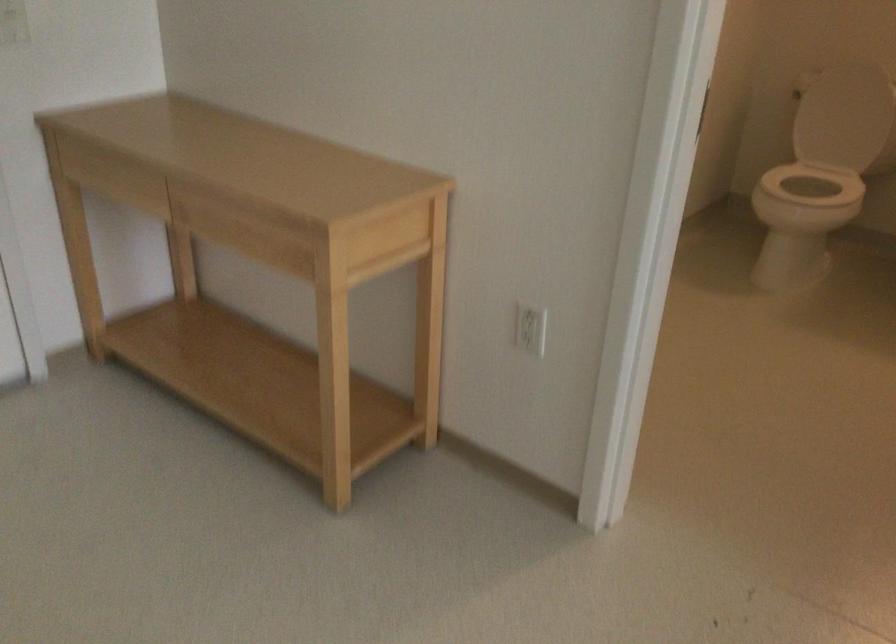
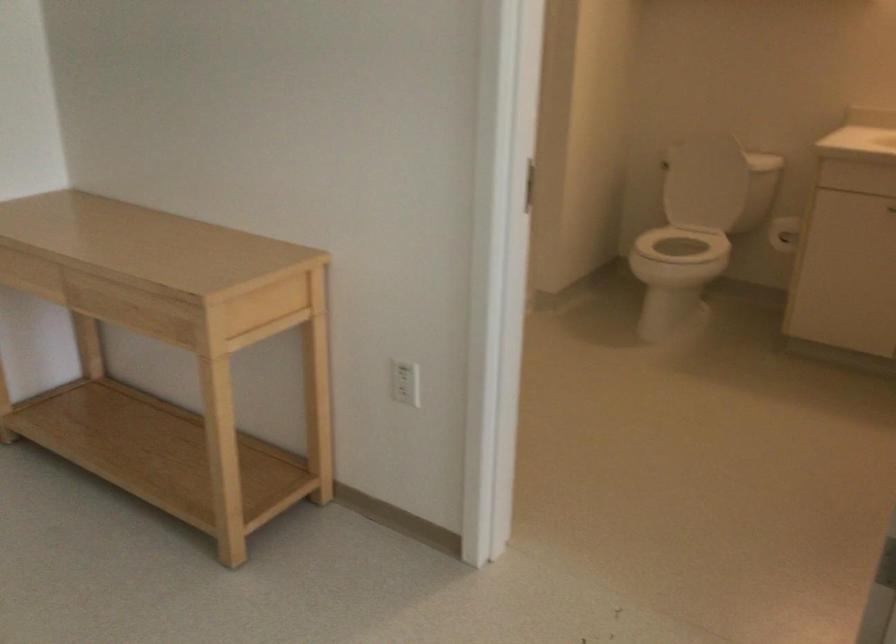
Question: How did the camera likely rotate?

Choices:
 (A) Left
 (B) Right
 (C) Up
 (D) Down

Answer: (C)